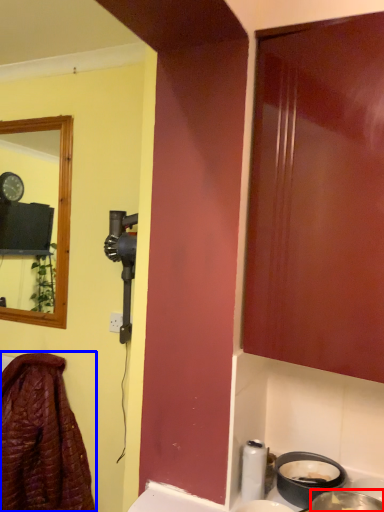
Question: Among these objects, which one is farthest to the camera, basin (highlighted by a red box) or laundry (highlighted by a blue box)?

Choices:
 (A) basin
 (B) laundry

Answer: (B)